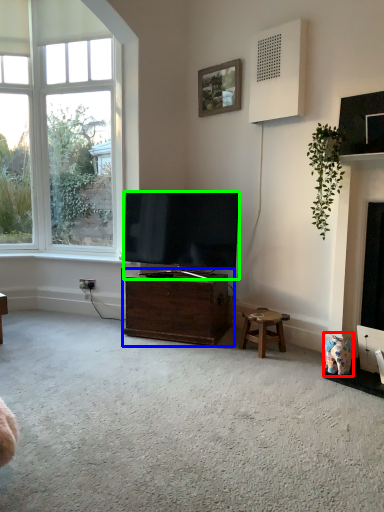
Question: Based on their relative distances, which object is farther from toy (highlighted by a red box)? Choose from cabinetry (highlighted by a blue box) and television (highlighted by a green box).

Choices:
 (A) cabinetry
 (B) television

Answer: (B)